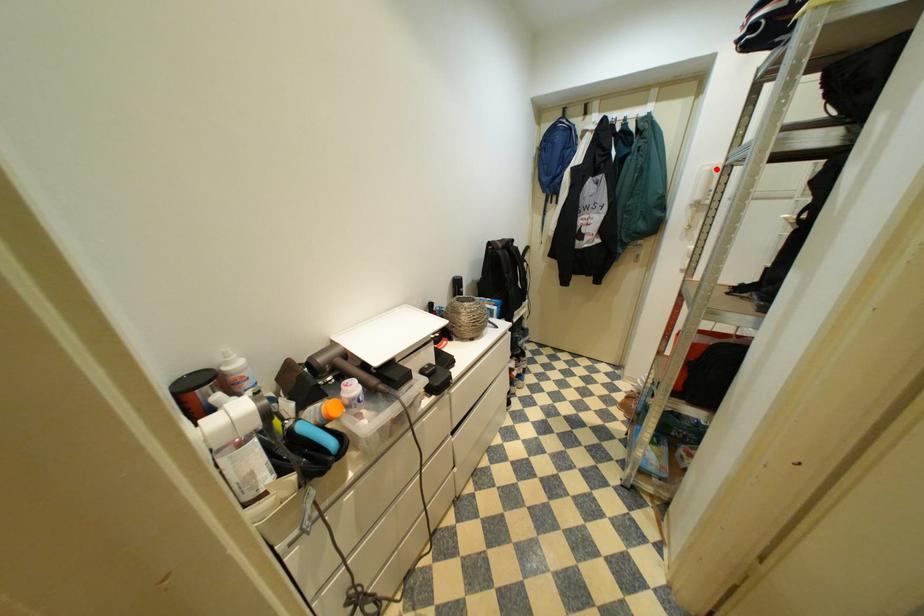
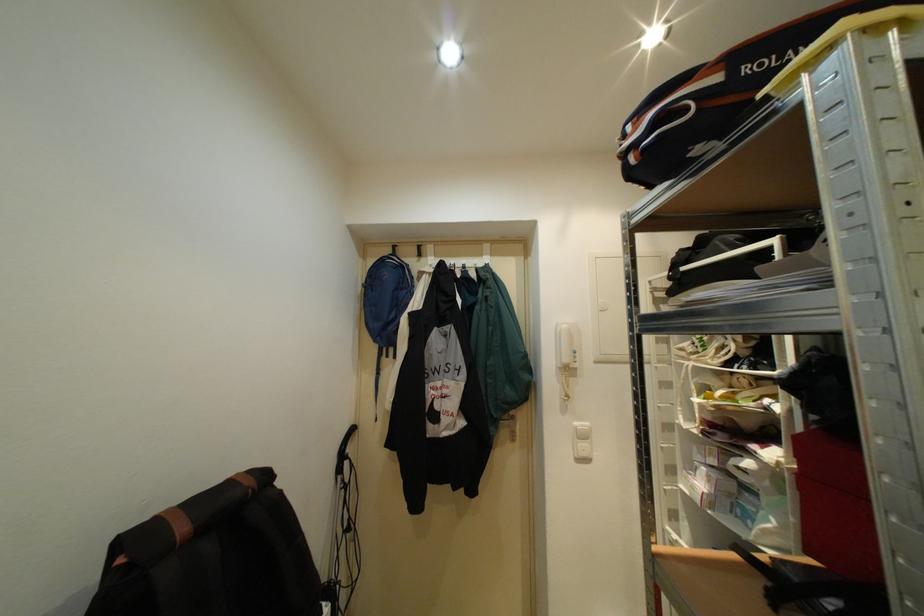
Where in the second image is the point corresponding to the highlighted location from the first image?

(573, 328)